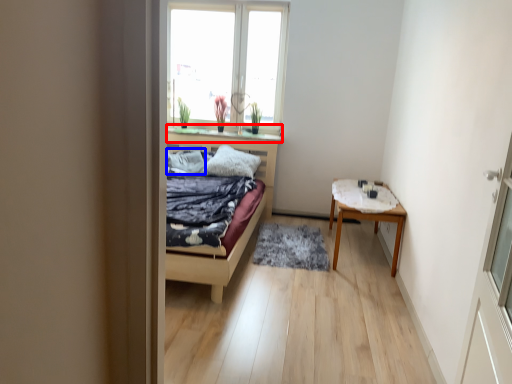
Question: Which point is closer to the camera, window sill (highlighted by a red box) or pillow (highlighted by a blue box)?

Choices:
 (A) window sill
 (B) pillow

Answer: (B)